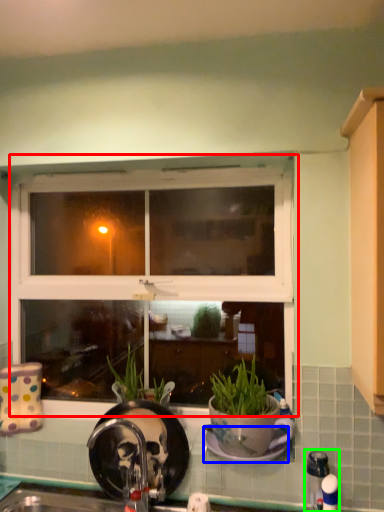
Question: Which is nearer to the window (highlighted by a red box)? plate (highlighted by a blue box) or faucet (highlighted by a green box).

Choices:
 (A) plate
 (B) faucet

Answer: (A)